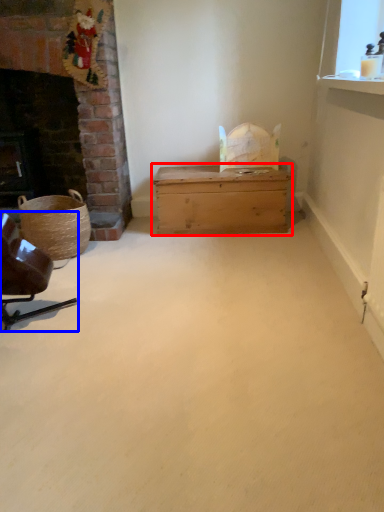
Question: Which of the following is the closest to the observer, table (highlighted by a red box) or chair (highlighted by a blue box)?

Choices:
 (A) table
 (B) chair

Answer: (B)